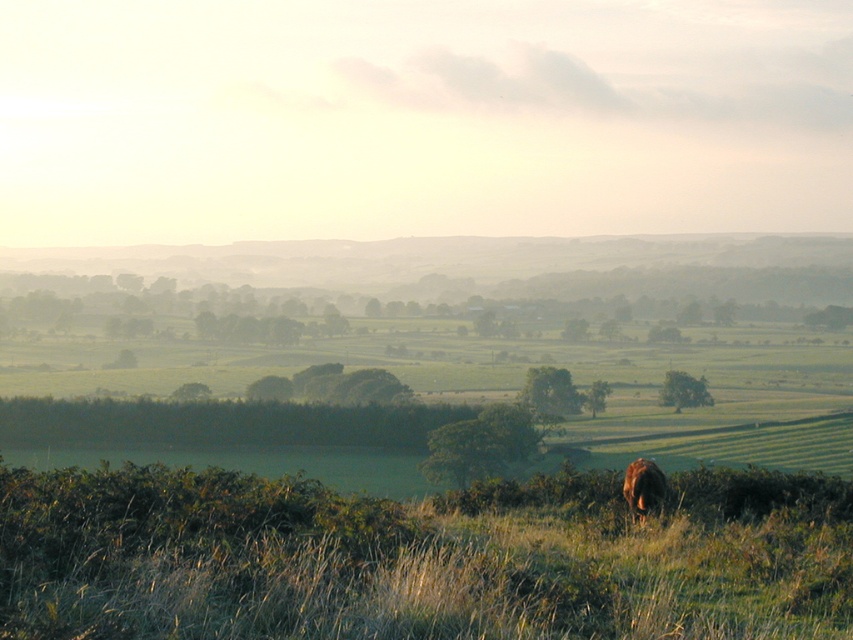
You are a photographer standing in the field and want to capture both the green grassy at lower center and the brown furry animal at lower center in your photo. Which object should you focus on first if you want to ensure both are in sharp focus?

You should focus on the brown furry animal at lower center first because it is closer to you than the green grassy at lower center, which is located above it. By focusing on the closer object, you can ensure both are within the depth of field.

You are standing in the middle of the field and see the green grassy at lower center and the brown furry animal at lower center. Which one is to your left?

The green grassy at lower center is positioned on the left side of brown furry animal at lower center, so the green grassy at lower center is to your left.